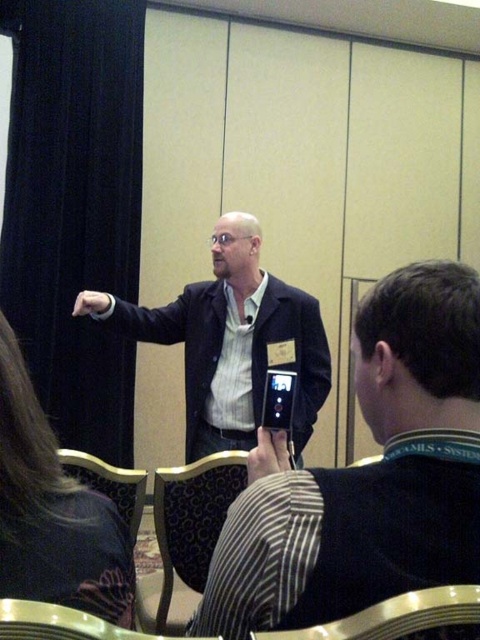
You are attending a conference and need to sit down. You see a matte black suit at center and a patterned fabric chair at lower center. Which object is closer to the right side of the scene?

The matte black suit at center is to the right of the patterned fabric chair at lower center, so the matte black suit at center is closer to the right side of the scene.

You are standing in a conference room and want to hand a document to the person wearing the matte black suit at center. If you can reach up to 2 meters, can you reach them without moving?

The matte black suit at center and viewer are 2.11 meters apart from each other. Since your maximum reach is 2 meters, you cannot reach them without moving closer.

You are organizing a photo shoot and need to ensure that all the props fit within a 1.5 meter wide backdrop. Given that the matte black suit at center and the patterned fabric chair at lower left are part of the setup, can you confirm if both items will fit side by side within the backdrop?

The matte black suit at center is wider than the patterned fabric chair at lower left. However, without knowing the exact combined width of both items, it is impossible to determine if they will fit within the 1.5 meter backdrop. Additional measurements are required.